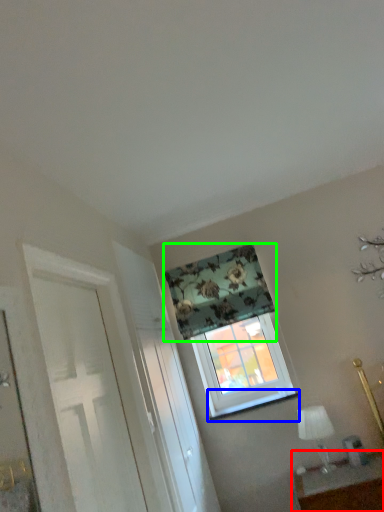
Question: Based on their relative distances, which object is farther from table (highlighted by a red box)? Choose from window sill (highlighted by a blue box) and curtain (highlighted by a green box).

Choices:
 (A) window sill
 (B) curtain

Answer: (B)